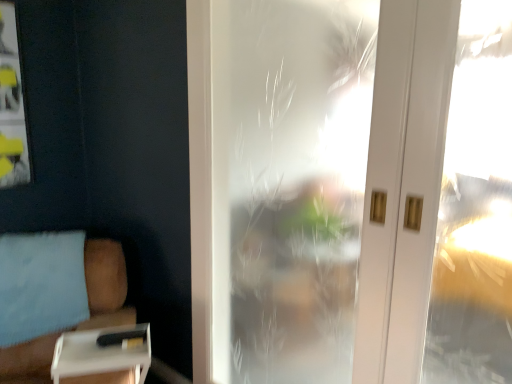
Question: In terms of size, does white plastic tray at lower left appear bigger or smaller than frosted glass door at center?

Choices:
 (A) small
 (B) big

Answer: (A)

Question: Visually, is white plastic tray at lower left positioned to the left or to the right of frosted glass door at center?

Choices:
 (A) right
 (B) left

Answer: (B)

Question: Based on their relative distances, which object is farther from the frosted glass door at center?

Choices:
 (A) white plastic tray at lower left
 (B) white matte box at lower left

Answer: (A)

Question: Which is nearer to the white matte box at lower left?

Choices:
 (A) white plastic tray at lower left
 (B) frosted glass door at center

Answer: (A)